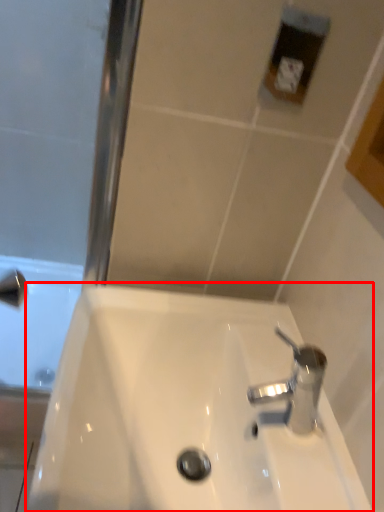
Question: From the image's perspective, what is the correct spatial relationship of sink (annotated by the red box) in relation to tap?

Choices:
 (A) below
 (B) above

Answer: (A)